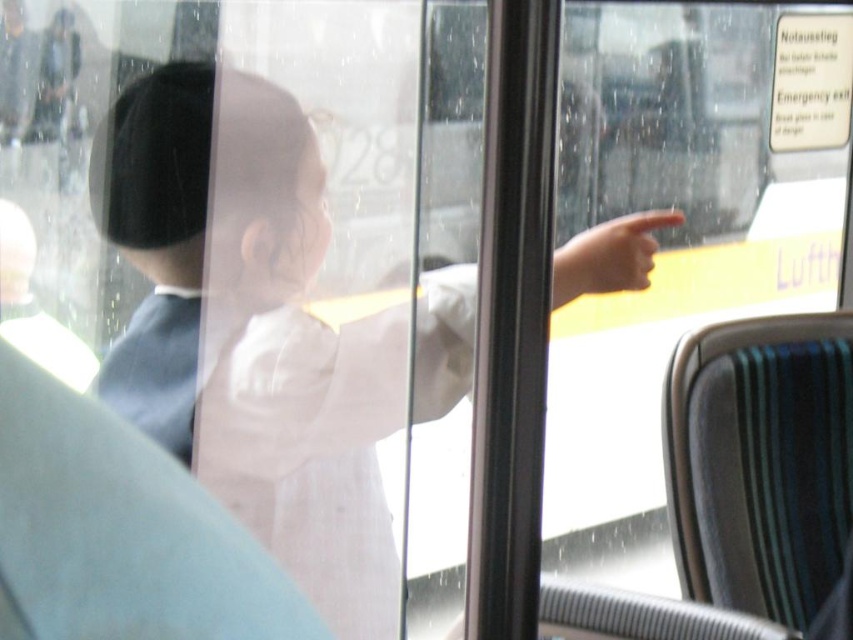
Can you confirm if white cloth at center is taller than smooth skin hand at center?

Correct, white cloth at center is much taller as smooth skin hand at center.

The width and height of the screenshot is (853, 640). Describe the element at coordinates (248, 326) in the screenshot. I see `white cloth at center` at that location.

Who is more forward, (277,324) or (677,225)?

Positioned in front is point (277,324).

You are a GUI agent. You are given a task and a screenshot of the screen. Output one action in this format:
    pyautogui.click(x=<x>, y=<y>)
    Task: Click on the white cloth at center
    This screenshot has width=853, height=640.
    Given the screenshot: What is the action you would take?
    pyautogui.click(x=248, y=326)